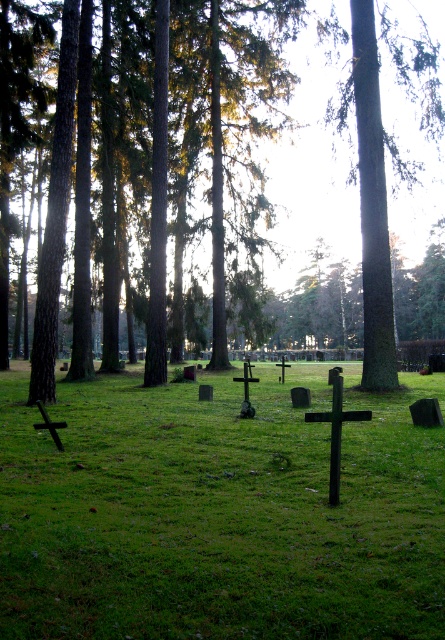
Question: Among these points, which one is farthest from the camera?

Choices:
 (A) [x=149, y=310]
 (B) [x=37, y=490]
 (C) [x=375, y=324]

Answer: (A)

Question: Is green grassy at center in front of green rough bark tree at center?

Choices:
 (A) yes
 (B) no

Answer: (A)

Question: Among these points, which one is farthest from the camera?

Choices:
 (A) (383, 16)
 (B) (214, 184)
 (C) (254, 486)

Answer: (B)

Question: Among these points, which one is farthest from the camera?

Choices:
 (A) (388, 381)
 (B) (138, 124)
 (C) (28, 611)

Answer: (B)

Question: Can you confirm if brown wood tree at center is smaller than green rough bark tree at center?

Choices:
 (A) yes
 (B) no

Answer: (B)

Question: Is brown wood tree at center bigger than green rough bark tree at center?

Choices:
 (A) yes
 (B) no

Answer: (A)